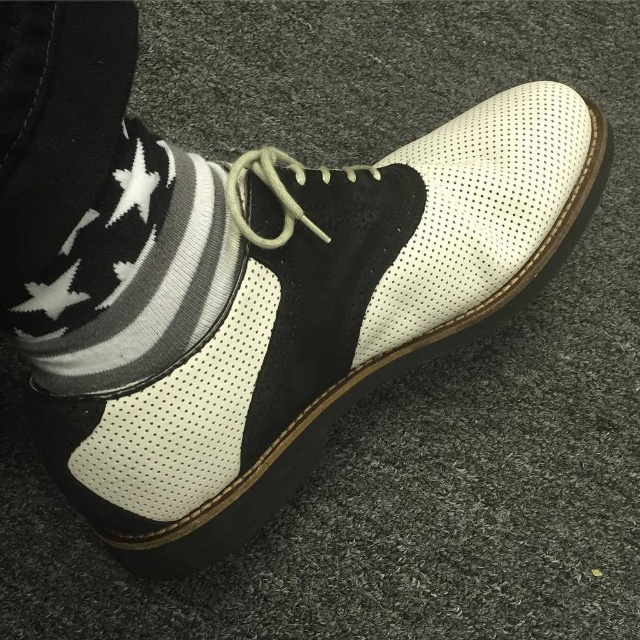
Question: Which point is farther to the camera?

Choices:
 (A) white perforated leather shoe at center
 (B) white knitted sock at lower left

Answer: (A)

Question: Is white perforated leather shoe at center behind white knitted sock at lower left?

Choices:
 (A) no
 (B) yes

Answer: (B)

Question: Can you confirm if white perforated leather shoe at center is positioned to the right of white knitted sock at lower left?

Choices:
 (A) no
 (B) yes

Answer: (B)

Question: Can you confirm if white perforated leather shoe at center is bigger than white knitted sock at lower left?

Choices:
 (A) no
 (B) yes

Answer: (B)